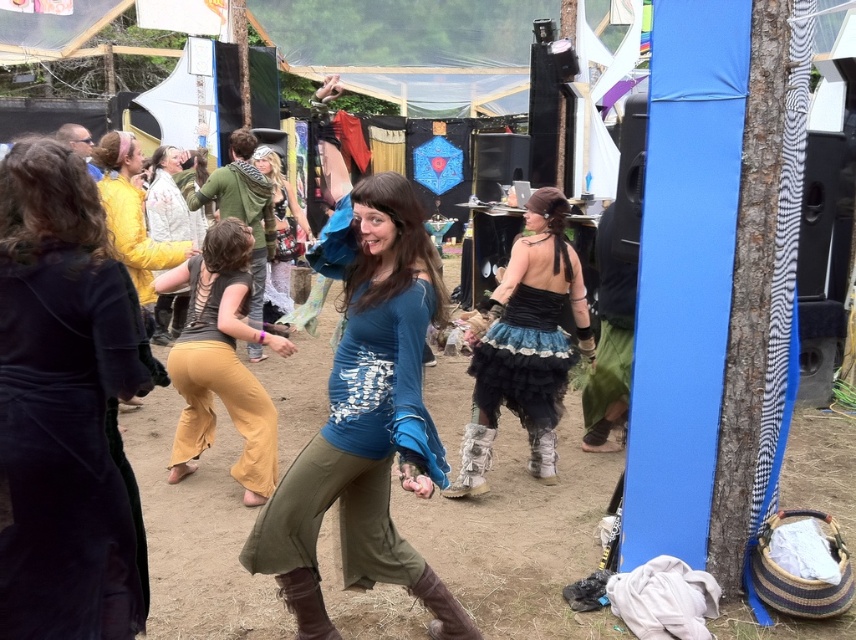
Is point (224, 257) farther from camera compared to point (299, 225)?

No, (224, 257) is closer to viewer.

Looking at this image, can you confirm if matte brown pants at center is positioned below matte lace dress at center?

Yes, matte brown pants at center is below matte lace dress at center.

The width and height of the screenshot is (856, 640). I want to click on matte brown pants at center, so click(221, 360).

Between black lace skirt at center and matte brown pants at center, which one is positioned higher?

black lace skirt at center

Where is `black lace skirt at center`? black lace skirt at center is located at coordinates (526, 344).

Does velvet yellow dress at upper left appear on the right side of black lace skirt at center?

No, velvet yellow dress at upper left is not to the right of black lace skirt at center.

Between point (16, 534) and point (556, 328), which one is positioned behind?

The point (556, 328) is behind.

Locate an element on the screen. The height and width of the screenshot is (640, 856). velvet yellow dress at upper left is located at coordinates (62, 404).

Find the location of a particular element. The height and width of the screenshot is (640, 856). velvet yellow dress at upper left is located at coordinates (62, 404).